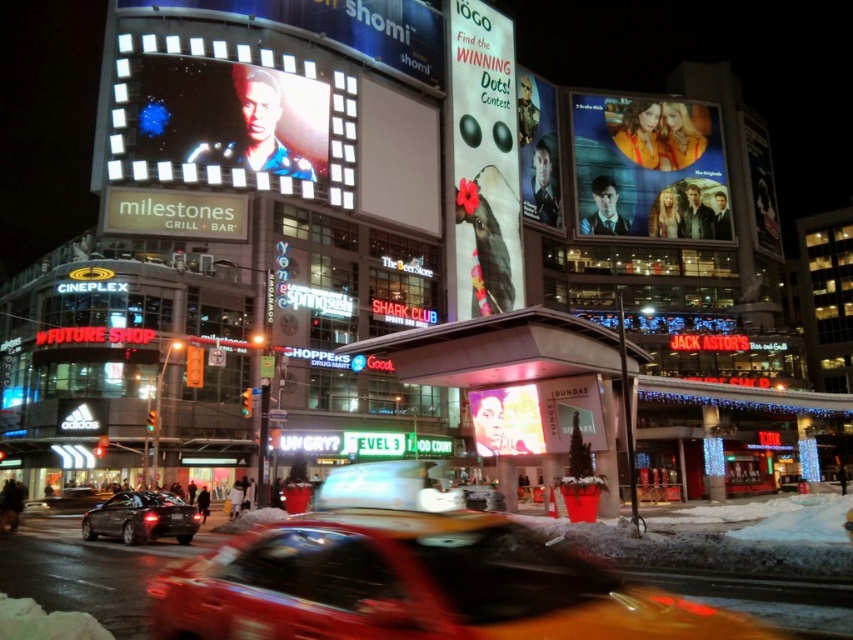
Question: Is white matte signboard at center further to camera compared to metallic silver poster at upper right?

Choices:
 (A) yes
 (B) no

Answer: (B)

Question: Is white matte signboard at center smaller than metallic silver car at center?

Choices:
 (A) no
 (B) yes

Answer: (A)

Question: From the image, what is the correct spatial relationship of matte digital billboard at upper left in relation to white matte signboard at center?

Choices:
 (A) below
 (B) above

Answer: (B)

Question: Which object is the closest to the shiny black sedan at lower left?

Choices:
 (A) matte plastic poster at upper right
 (B) metallic silver car at center
 (C) matte black cow at upper center

Answer: (B)

Question: Estimate the real-world distances between objects in this image. Which object is closer to the shiny black sedan at lower left?

Choices:
 (A) metallic silver poster at upper right
 (B) yellow rubber taxi at center
 (C) matte plastic poster at upper right
 (D) metallic silver car at center

Answer: (B)

Question: Among these points, which one is farthest from the camera?

Choices:
 (A) (549, 161)
 (B) (67, 500)

Answer: (A)